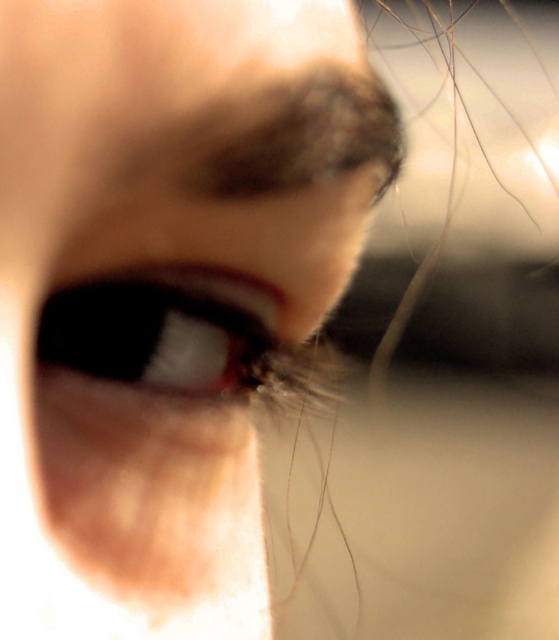
Does pink glossy tongue at center have a lesser height compared to satin black eye at center?

In fact, pink glossy tongue at center may be taller than satin black eye at center.

Looking at this image, who is more forward, (239, 506) or (167, 362)?

Point (167, 362) is in front.

Based on the photo, who is more forward, [196,596] or [146,291]?

Point [146,291] is more forward.

You are a GUI agent. You are given a task and a screenshot of the screen. Output one action in this format:
    pyautogui.click(x=<x>, y=<y>)
    Task: Click on the pink glossy tongue at center
    This screenshot has height=640, width=559.
    Given the screenshot: What is the action you would take?
    164,291